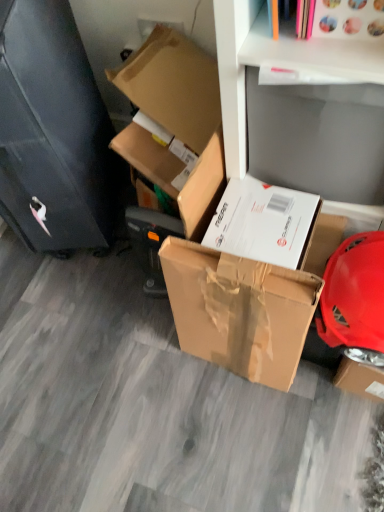
Identify the location of free spot in front of brown cardboard box at center, which is the 1th box in bottom-to-top order. This screenshot has width=384, height=512. (245, 426).